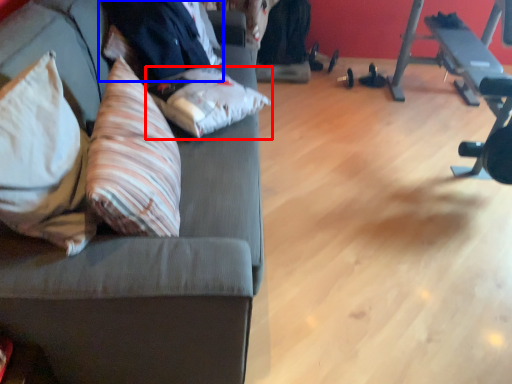
Question: Which object appears farthest to the camera in this image, pillow (highlighted by a red box) or businessman (highlighted by a blue box)?

Choices:
 (A) pillow
 (B) businessman

Answer: (B)